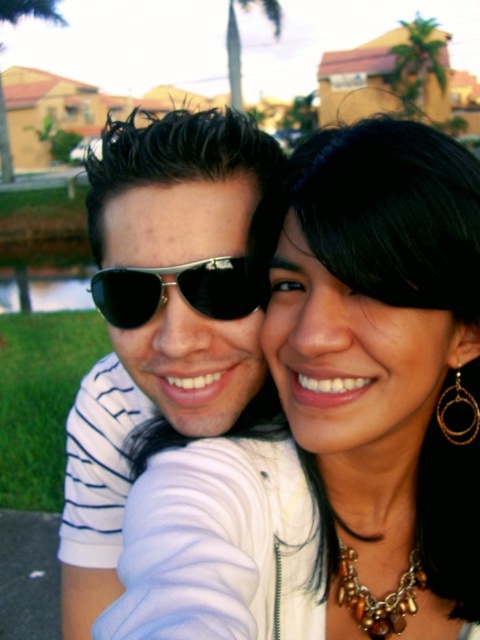
You are a photographer trying to capture a close detail shot of the sunglasses in the image. The matte black sunglasses at center and the metallic aviator sunglasses at center are both in focus. Which pair of sunglasses has a taller frame?

The matte black sunglasses at center has a greater height compared to the metallic aviator sunglasses at center, so the matte black sunglasses at center has a taller frame.

You are a photographer setting up a shoot in a suburban backyard with palm trees. You notice two items in the frame that might distract from the subjects. The items are the white fabric at center and the matte black sunglasses at center. Which item should you adjust to make it less distracting based on its size?

The white fabric at center is smaller than the matte black sunglasses at center, so adjusting the matte black sunglasses at center would be more effective in reducing distraction due to its larger size.

You are a photographer trying to adjust the lighting for a photo shoot. You notice the white fabric at center and the metallic aviator sunglasses at center. Which object is positioned to the right of the other?

The white fabric at center is to the right of the metallic aviator sunglasses at center.